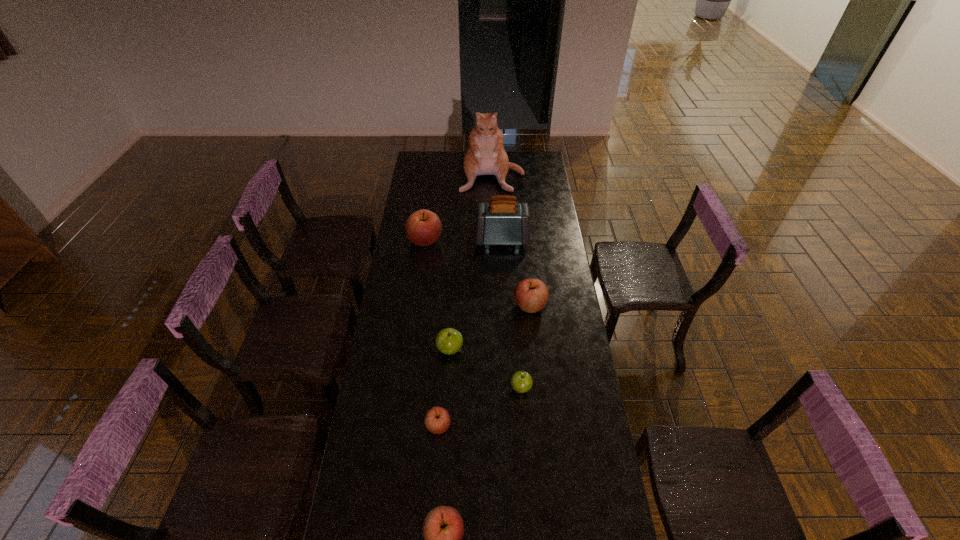
Locate an element on the screen. This screenshot has height=540, width=960. empty space between the fifth nearest apple and the farthest red apple is located at coordinates (478, 273).

Where is `blank region between the rightmost red apple and the nearer green apple`? blank region between the rightmost red apple and the nearer green apple is located at coordinates (525, 347).

Where is `free area in between the seventh shortest object and the third nearest red apple`? Image resolution: width=960 pixels, height=540 pixels. free area in between the seventh shortest object and the third nearest red apple is located at coordinates (516, 273).

Locate an element on the screen. This screenshot has height=540, width=960. vacant space that's between the seventh shortest object and the right green apple is located at coordinates (511, 314).

Find the location of a particular element. This screenshot has height=540, width=960. vacant space that is in between the third nearest apple and the second nearest apple is located at coordinates (480, 407).

Identify which object is the fourth nearest to the fourth nearest object. Please provide its 2D coordinates. Your answer should be formatted as a tuple, i.e. [(x, y)], where the tuple contains the x and y coordinates of a point satisfying the conditions above.

[(423, 227)]

Identify the location of object that is the second closest one to the farthest apple. (485, 156).

The image size is (960, 540). In order to click on apple identified as the sixth closest to the toaster in this screenshot , I will do `click(443, 529)`.

Locate an element on the screen. apple that stands as the sixth closest to the second tallest object is located at coordinates (443, 529).

You are a GUI agent. You are given a task and a screenshot of the screen. Output one action in this format:
    pyautogui.click(x=<x>, y=<y>)
    Task: Click on the red apple object that ranks as the fourth closest to the bigger green apple
    This screenshot has height=540, width=960.
    Given the screenshot: What is the action you would take?
    pyautogui.click(x=443, y=529)